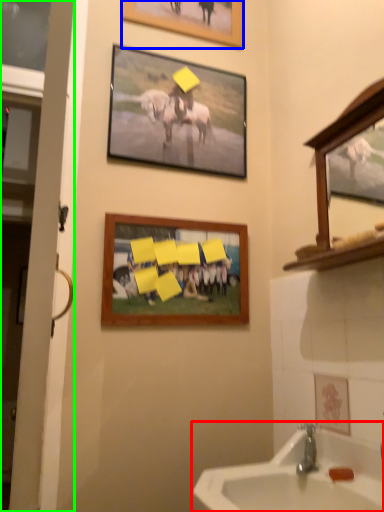
Question: Estimate the real-world distances between objects in this image. Which object is farther from sink (highlighted by a red box), picture frame (highlighted by a blue box) or door (highlighted by a green box)?

Choices:
 (A) picture frame
 (B) door

Answer: (A)